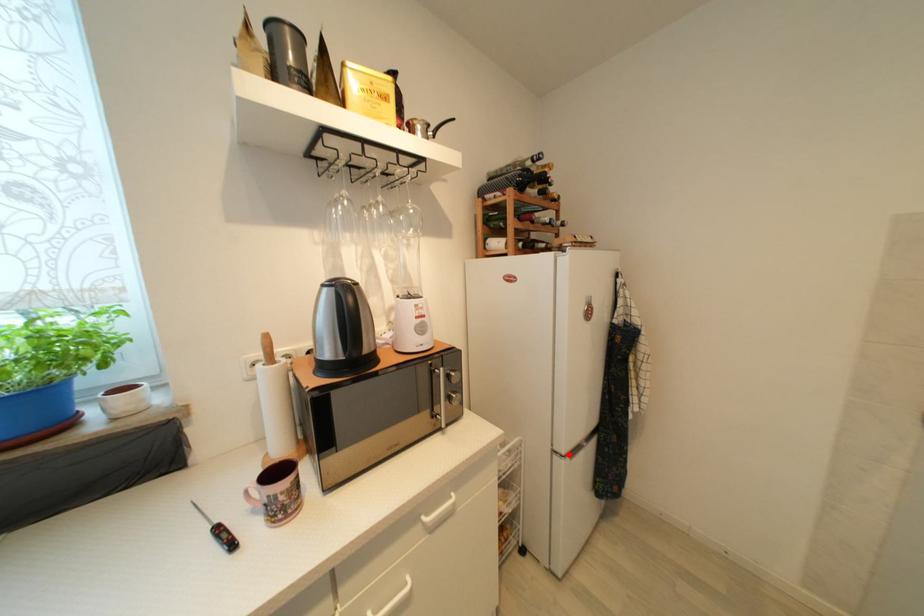
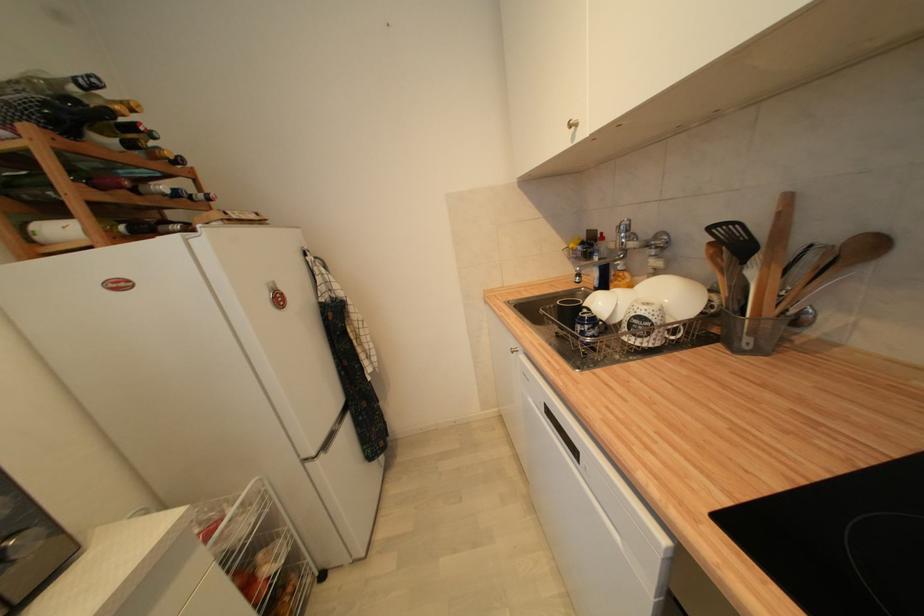
Question: I am providing you with two images of the same scene from different viewpoints. In image1, a red point is highlighted. Considering the same 3D point in image2, which of the following is correct?

Choices:
 (A) It is closer
 (B) It is farther

Answer: (A)